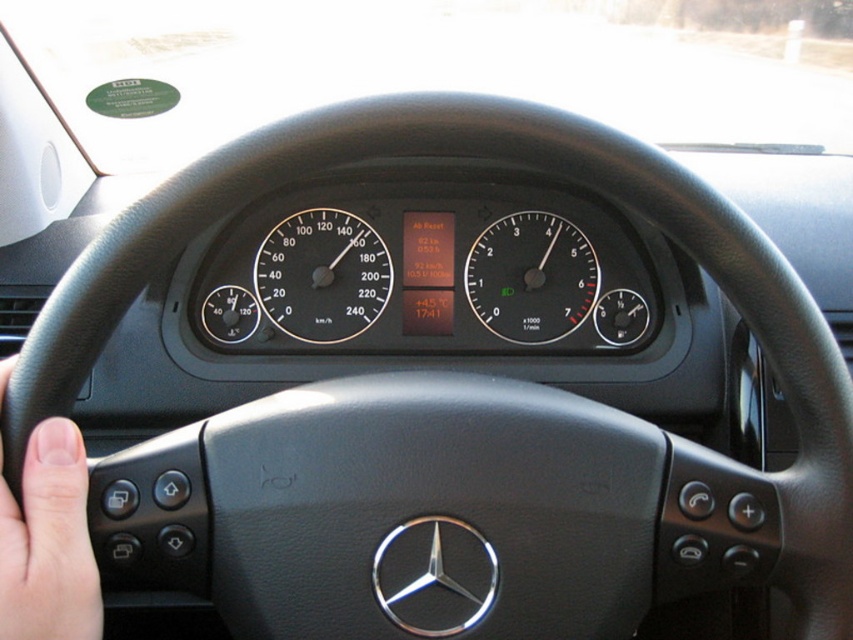
Can you confirm if black plastic speedometer at center is wider than black glass speedometer at center?

Incorrect, black plastic speedometer at center's width does not surpass black glass speedometer at center's.

Between black plastic speedometer at center and black glass speedometer at center, which one appears on the left side from the viewer's perspective?

From the viewer's perspective, black plastic speedometer at center appears more on the left side.

Between point (352, 288) and point (560, 314), which one is positioned behind?

Positioned behind is point (560, 314).

Where is `black plastic speedometer at center`? Image resolution: width=853 pixels, height=640 pixels. black plastic speedometer at center is located at coordinates pos(322,275).

Who is more distant from viewer, (74,468) or (271,250)?

The point (271,250) is behind.

Consider the image. Does light skin/soft touch finger at center have a larger size compared to black plastic speedometer at center?

Correct, light skin/soft touch finger at center is larger in size than black plastic speedometer at center.

The width and height of the screenshot is (853, 640). I want to click on light skin/soft touch finger at center, so click(48, 541).

Locate an element on the screen. This screenshot has width=853, height=640. light skin/soft touch finger at center is located at coordinates click(x=48, y=541).

What do you see at coordinates (48, 541) in the screenshot?
I see `light skin/soft touch finger at center` at bounding box center [48, 541].

Measure the distance between light skin/soft touch finger at center and camera.

light skin/soft touch finger at center is 61.48 centimeters from camera.

I want to click on light skin/soft touch finger at center, so click(x=48, y=541).